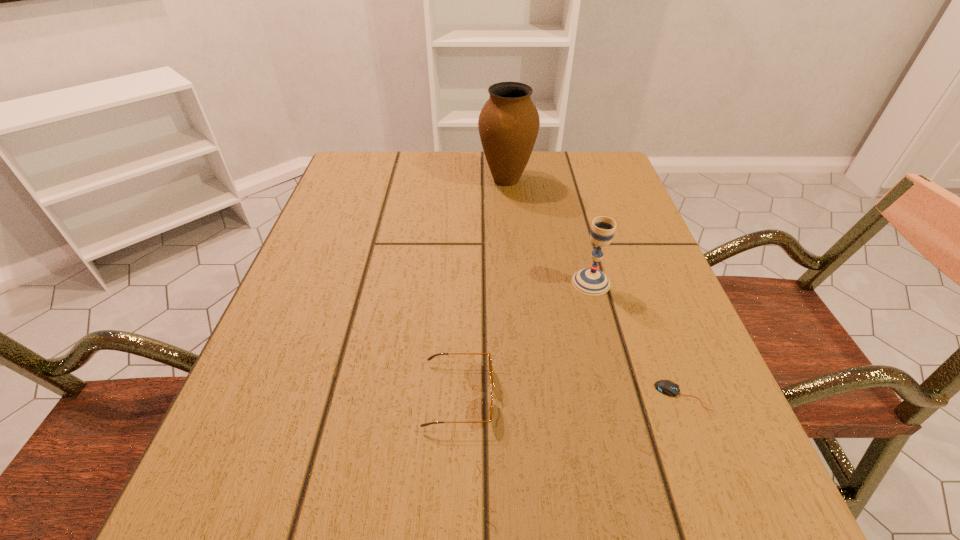
Where is `vacant space situated 0.100m on the back of the rightmost object`? vacant space situated 0.100m on the back of the rightmost object is located at coordinates (658, 332).

At what (x,y) coordinates should I click in order to perform the action: click on object located in the far edge section of the desktop. Please return your answer as a coordinate pair (x, y). Image resolution: width=960 pixels, height=540 pixels. Looking at the image, I should click on (508, 124).

You are a GUI agent. You are given a task and a screenshot of the screen. Output one action in this format:
    pyautogui.click(x=<x>, y=<y>)
    Task: Click on the chalice that is at the right edge
    
    Given the screenshot: What is the action you would take?
    (x=590, y=281)

This screenshot has width=960, height=540. I want to click on mouse that is positioned at the right edge, so click(x=667, y=387).

Where is `free region at the far edge of the desktop`? free region at the far edge of the desktop is located at coordinates (551, 190).

The height and width of the screenshot is (540, 960). What are the coordinates of `free space at the left edge of the desktop` in the screenshot? It's located at (360, 208).

Image resolution: width=960 pixels, height=540 pixels. Identify the location of vacant space at the right edge. (686, 325).

At what (x,y) coordinates should I click in order to perform the action: click on free space at the far left corner of the desktop. Please return your answer as a coordinate pair (x, y). This screenshot has height=540, width=960. Looking at the image, I should click on point(393,177).

The image size is (960, 540). Identify the location of vacant space at the far right corner of the desktop. (594, 175).

The image size is (960, 540). Find the location of `free space between the shortest object and the sunglasses`. free space between the shortest object and the sunglasses is located at coordinates (570, 395).